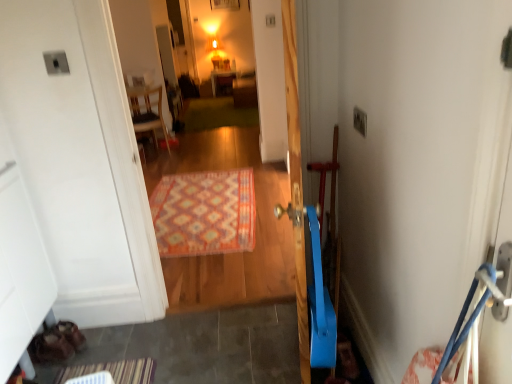
Question: From the image's perspective, is multicolored woven rug at center positioned above or below matte wooden cabinet at center, which is counted as the 1th furniture, starting from the back?

Choices:
 (A) below
 (B) above

Answer: (A)

Question: Based on their sizes in the image, would you say multicolored woven rug at center is bigger or smaller than matte wooden cabinet at center, which is the 2th furniture from left to right?

Choices:
 (A) small
 (B) big

Answer: (A)

Question: Estimate the real-world distances between objects in this image. Which object is farther from the multicolored woven rug at center?

Choices:
 (A) wooden chair at upper left, arranged as the 1th furniture when viewed from the front
 (B) carpeted rug at center
 (C) matte wooden cabinet at center, which is the 2th furniture from left to right

Answer: (C)

Question: Estimate the real-world distances between objects in this image. Which object is farther from the matte wooden cabinet at center, which is counted as the first furniture, starting from the top?

Choices:
 (A) carpeted rug at center
 (B) multicolored woven rug at center
 (C) wooden chair at upper left, the 2th furniture positioned from the top

Answer: (B)